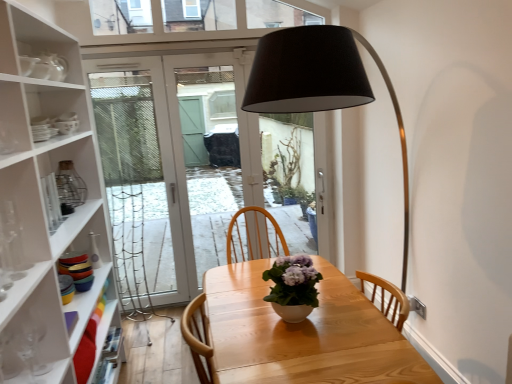
Find the location of a particular element. The width and height of the screenshot is (512, 384). light wood table at center is located at coordinates (296, 334).

Describe the element at coordinates (182, 156) in the screenshot. I see `matte white door at center` at that location.

Find the location of a particular element. This screenshot has width=512, height=384. white glossy vase at center is located at coordinates (293, 287).

At what (x,y) coordinates should I click in order to perform the action: click on light wood table at center. Please return your answer as a coordinate pair (x, y). The width and height of the screenshot is (512, 384). Looking at the image, I should click on (296, 334).

Is white glossy vase at center taller than matte white door at center?

Incorrect, the height of white glossy vase at center is not larger of that of matte white door at center.

From the image's perspective, which is above, white glossy vase at center or matte white door at center?

matte white door at center appears higher in the image.

From a real-world perspective, is white glossy vase at center under matte white door at center?

Yes.

In the image, is white glossy vase at center on the left side or the right side of matte white door at center?

In the image, white glossy vase at center appears on the right side of matte white door at center.

Where is `door above the light wood table at center (from the image's perspective)`? door above the light wood table at center (from the image's perspective) is located at coordinates (182, 156).

Is point (216, 92) closer or farther from the camera than point (333, 319)?

Point (216, 92) is positioned farther from the camera compared to point (333, 319).

From the picture: From the image's perspective, which is above, matte white door at center or light wood table at center?

matte white door at center.

Find the location of a particular element. The image size is (512, 384). glass vase located behind the white glossy vase at center is located at coordinates (70, 185).

Would you say clear glass vase at left is inside or outside white glossy vase at center?

clear glass vase at left is spatially situated outside white glossy vase at center.

Is clear glass vase at left not near white glossy vase at center?

Yes, clear glass vase at left and white glossy vase at center are quite far apart.

Looking at this image, is light wood table at center far from clear glass vase at left?

Yes, light wood table at center and clear glass vase at left are located far from each other.

Identify the location of glass vase above the light wood table at center (from the image's perspective). This screenshot has height=384, width=512. (70, 185).

Which is behind, point (234, 328) or point (56, 182)?

The point (56, 182) is farther from the camera.

From a real-world perspective, which is physically above, light wood table at center or clear glass vase at left?

Answer: From a 3D spatial view, clear glass vase at left is above.

Where is `door behind the clear glass vase at left`? door behind the clear glass vase at left is located at coordinates (182, 156).

Looking at this image, which object is positioned more to the left, clear glass vase at left or matte white door at center?

Positioned to the left is clear glass vase at left.

Considering the positions of objects clear glass vase at left and matte white door at center in the image provided, who is behind, clear glass vase at left or matte white door at center?

matte white door at center is further from the camera.

Could you tell me if clear glass vase at left is facing matte white door at center?

No.

Based on the photo, can you confirm if white glossy vase at center is positioned to the left of clear glass vase at left?

No.

Which object is wider, white glossy vase at center or clear glass vase at left?

Wider between the two is white glossy vase at center.

Considering the relative positions of white glossy vase at center and clear glass vase at left in the image provided, is white glossy vase at center in front of clear glass vase at left?

Yes, it is.

From the picture: Which point is more distant from viewer, (280, 279) or (62, 176)?

Point (62, 176)

How many degrees apart are the facing directions of light wood table at center and matte white door at center?

There is a 179-degree angle between the facing directions of light wood table at center and matte white door at center.

Considering the sizes of objects light wood table at center and matte white door at center in the image provided, who is shorter, light wood table at center or matte white door at center?

light wood table at center.

From a real-world perspective, is light wood table at center above or below matte white door at center?

Clearly, from a real-world perspective, light wood table at center is below matte white door at center.

Can you confirm if light wood table at center is positioned to the left of matte white door at center?

Incorrect, light wood table at center is not on the left side of matte white door at center.

In order to click on door behind the white glossy vase at center in this screenshot , I will do `click(182, 156)`.

Locate an element on the screen. table lying in front of the matte white door at center is located at coordinates (296, 334).

Considering their positions, is matte white door at center positioned closer to white glossy vase at center than light wood table at center?

light wood table at center.

Considering their positions, is light wood table at center positioned further to matte white door at center than white glossy vase at center?

white glossy vase at center is further to matte white door at center.

From the image, which object appears to be nearer to white glossy vase at center, light wood table at center or clear glass vase at left?

light wood table at center is closer to white glossy vase at center.

Based on their spatial positions, is matte white door at center or white glossy vase at center closer to light wood table at center?

white glossy vase at center.

When comparing their distances from light wood table at center, does white glossy vase at center or matte white door at center seem closer?

white glossy vase at center.

When comparing their distances from light wood table at center, does matte white door at center or clear glass vase at left seem further?

Based on the image, matte white door at center appears to be further to light wood table at center.

From the image, which object appears to be nearer to clear glass vase at left, light wood table at center or matte white door at center?

light wood table at center is positioned closer to the anchor clear glass vase at left.

Considering their positions, is clear glass vase at left positioned further to white glossy vase at center than matte white door at center?

The object further to white glossy vase at center is matte white door at center.

Locate an element on the screen. houseplant between light wood table at center and matte white door at center in the front-back direction is located at coordinates (293, 287).

I want to click on houseplant between clear glass vase at left and light wood table at center in the horizontal direction, so click(293, 287).

At what (x,y) coordinates should I click in order to perform the action: click on glass vase between white glossy vase at center and matte white door at center in the front-back direction. Please return your answer as a coordinate pair (x, y). Looking at the image, I should click on (70, 185).

At what (x,y) coordinates should I click in order to perform the action: click on glass vase between light wood table at center and matte white door at center along the z-axis. Please return your answer as a coordinate pair (x, y). Looking at the image, I should click on point(70,185).